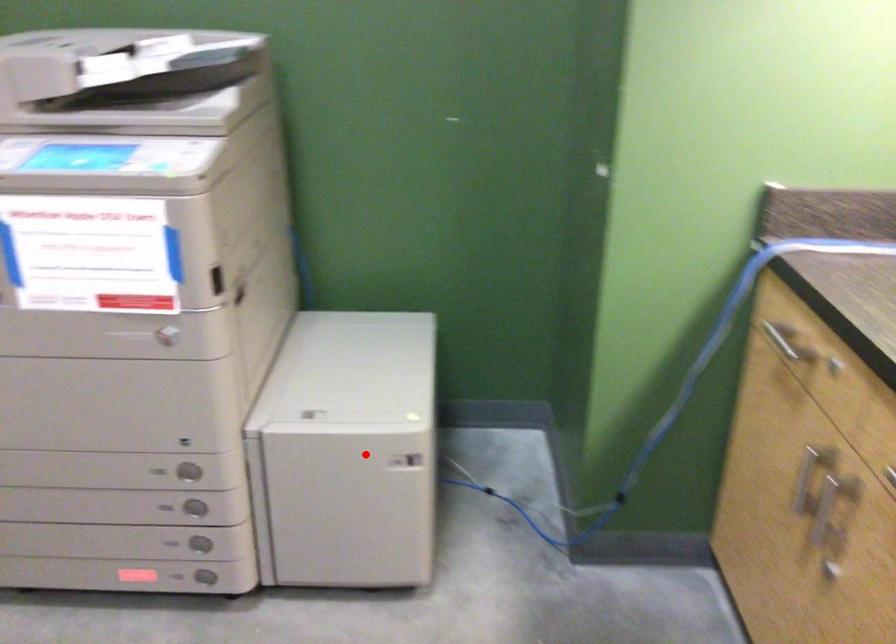
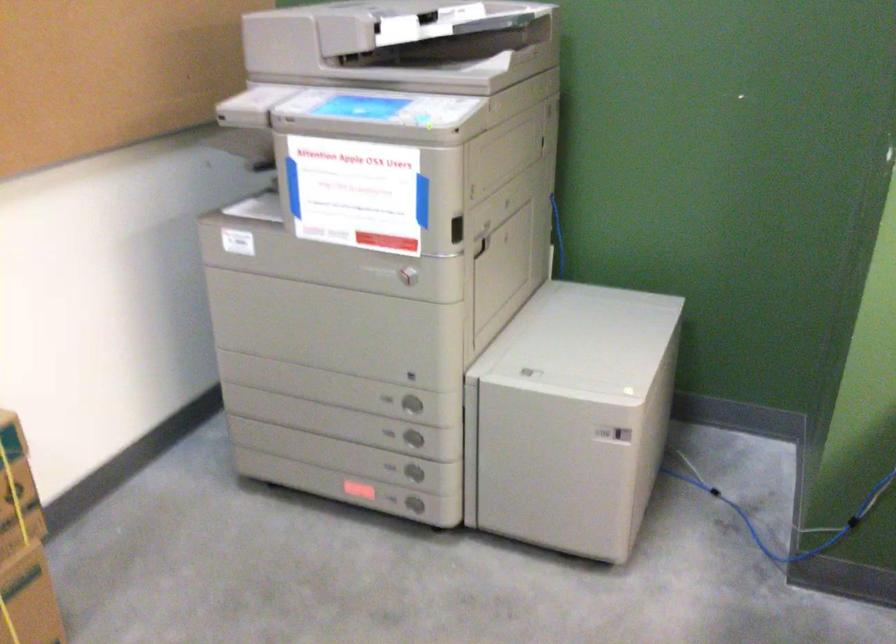
In the second image, find the point that corresponds to the highlighted location in the first image.

(572, 418)